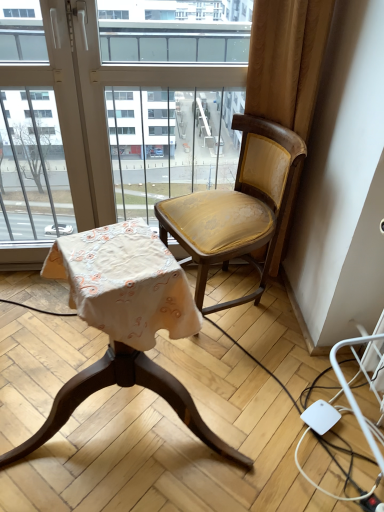
Question: Which direction should I rotate to look at matte gold fabric chair at center, placed as the 1th chair when sorted from left to right?

Choices:
 (A) left
 (B) right

Answer: (A)

Question: Does transparent glass window at upper center have a greater height compared to matte gold fabric chair at center, placed as the 1th chair when sorted from left to right?

Choices:
 (A) no
 (B) yes

Answer: (B)

Question: From a real-world perspective, is transparent glass window at upper center positioned over matte gold fabric chair at center, placed as the 1th chair when sorted from left to right, based on gravity?

Choices:
 (A) yes
 (B) no

Answer: (A)

Question: Considering the relative sizes of transparent glass window at upper center and matte gold fabric chair at center, the 2th chair when ordered from right to left, in the image provided, is transparent glass window at upper center bigger than matte gold fabric chair at center, the 2th chair when ordered from right to left,?

Choices:
 (A) no
 (B) yes

Answer: (A)

Question: Is transparent glass window at upper center not close to matte gold fabric chair at center, placed as the 1th chair when sorted from left to right?

Choices:
 (A) yes
 (B) no

Answer: (B)

Question: Is transparent glass window at upper center facing away from matte gold fabric chair at center, the 2th chair when ordered from right to left?

Choices:
 (A) yes
 (B) no

Answer: (A)

Question: Is transparent glass window at upper center positioned in front of matte gold fabric chair at center, placed as the 1th chair when sorted from left to right?

Choices:
 (A) yes
 (B) no

Answer: (B)

Question: Is transparent glass window at upper center turned away from matte gold fabric chair at right, which is the 1th chair in right-to-left order?

Choices:
 (A) yes
 (B) no

Answer: (B)

Question: Can you confirm if transparent glass window at upper center is taller than matte gold fabric chair at right, which is the 1th chair in right-to-left order?

Choices:
 (A) yes
 (B) no

Answer: (A)

Question: Can you confirm if transparent glass window at upper center is thinner than matte gold fabric chair at right, which is the 1th chair in right-to-left order?

Choices:
 (A) yes
 (B) no

Answer: (A)

Question: Is transparent glass window at upper center placed right next to matte gold fabric chair at right, which is the 1th chair in right-to-left order?

Choices:
 (A) no
 (B) yes

Answer: (A)

Question: From the image's perspective, would you say transparent glass window at upper center is shown under matte gold fabric chair at right, which is the 1th chair in right-to-left order?

Choices:
 (A) yes
 (B) no

Answer: (B)

Question: Is transparent glass window at upper center facing towards matte gold fabric chair at right, the second chair when ordered from left to right?

Choices:
 (A) no
 (B) yes

Answer: (B)

Question: From the image's perspective, is matte gold fabric chair at center, the 2th chair when ordered from right to left, over transparent glass window at upper center?

Choices:
 (A) yes
 (B) no

Answer: (B)